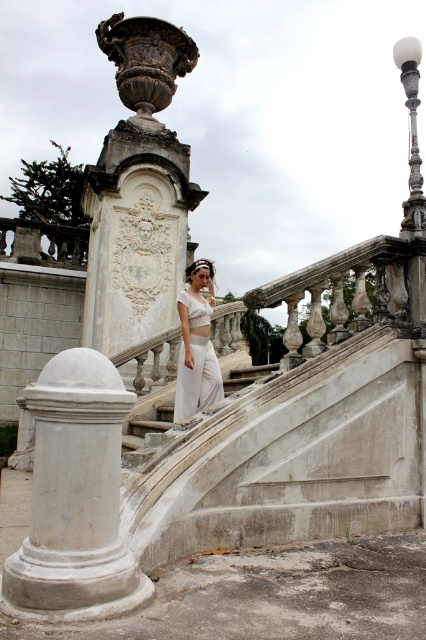
Question: Which object appears closest to the camera in this image?

Choices:
 (A) white marble vase at upper center
 (B) white cotton pants at center
 (C) white marble stairs at center
 (D) white marble column at center

Answer: (D)

Question: Which point is farther from the camera taking this photo?

Choices:
 (A) (169, 97)
 (B) (201, 390)
 (C) (141, 413)
 (D) (74, 522)

Answer: (A)

Question: Can you confirm if white marble vase at upper center is bigger than white cotton pants at center?

Choices:
 (A) no
 (B) yes

Answer: (B)

Question: Considering the real-world distances, which object is farthest from the white marble vase at upper center?

Choices:
 (A) white cotton pants at center
 (B) white marble column at center

Answer: (B)

Question: Does white marble vase at upper center have a greater width compared to white marble stairs at center?

Choices:
 (A) no
 (B) yes

Answer: (B)

Question: Is white cotton pants at center smaller than white marble stairs at center?

Choices:
 (A) no
 (B) yes

Answer: (B)